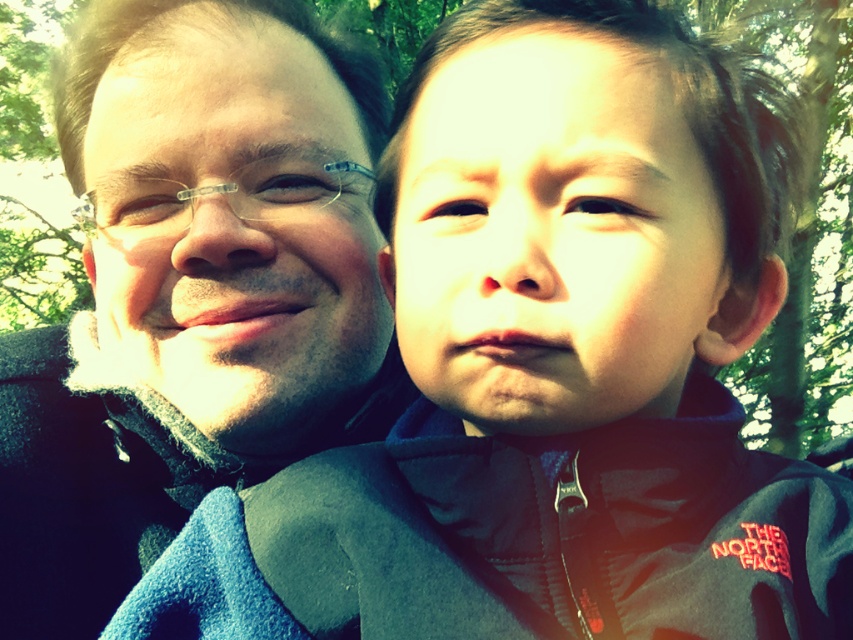
Can you confirm if dark gray fleece jacket at right is smaller than smooth skin face at center?

Incorrect, dark gray fleece jacket at right is not smaller in size than smooth skin face at center.

Which is behind, point (743, 180) or point (485, 340)?

Positioned behind is point (743, 180).

The image size is (853, 640). I want to click on dark gray fleece jacket at right, so click(x=602, y=321).

Does matte black jacket at left have a larger size compared to matte black glasses at left?

Yes, matte black jacket at left is bigger than matte black glasses at left.

Does matte black jacket at left have a lesser height compared to matte black glasses at left?

In fact, matte black jacket at left may be taller than matte black glasses at left.

Measure the distance between point [193,132] and camera.

They are 25.36 inches apart.

At what (x,y) coordinates should I click in order to perform the action: click on matte black jacket at left. Please return your answer as a coordinate pair (x, y). This screenshot has height=640, width=853. Looking at the image, I should click on (190, 292).

Does point (154, 275) come behind point (471, 64)?

Yes, point (154, 275) is farther from viewer.

Which is below, matte black jacket at left or smooth skin face at center?

Positioned lower is matte black jacket at left.

Where is `matte black jacket at left`? Image resolution: width=853 pixels, height=640 pixels. matte black jacket at left is located at coordinates (190, 292).

This screenshot has width=853, height=640. In order to click on matte black jacket at left in this screenshot , I will do `click(190, 292)`.